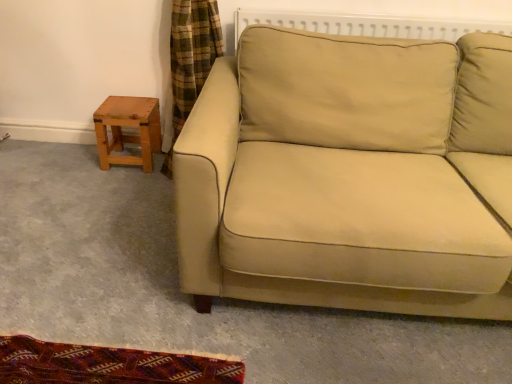
Find the location of `vacant area in front of light brown wooden stool at left`. vacant area in front of light brown wooden stool at left is located at coordinates (118, 177).